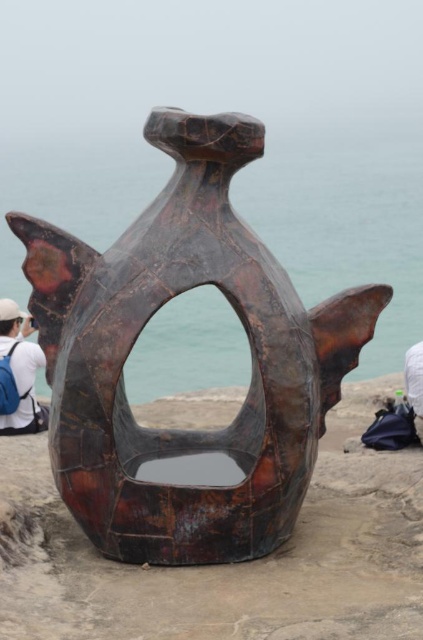
Question: Which point is farther from the camera taking this photo?

Choices:
 (A) (10, 323)
 (B) (386, 579)

Answer: (A)

Question: Is rusty metal fish at center positioned behind white fabric at upper left?

Choices:
 (A) no
 (B) yes

Answer: (A)

Question: Can you confirm if rusty metal sculpture at center is thinner than white fabric at upper left?

Choices:
 (A) yes
 (B) no

Answer: (B)

Question: Among these points, which one is farthest from the camera?

Choices:
 (A) (5, 298)
 (B) (370, 312)

Answer: (A)

Question: Which object is positioned closest to the rusty metal fish at center?

Choices:
 (A) white fabric at upper left
 (B) rusty metal sculpture at center

Answer: (B)

Question: Is rusty metal fish at center thinner than rusty metal sculpture at center?

Choices:
 (A) yes
 (B) no

Answer: (A)